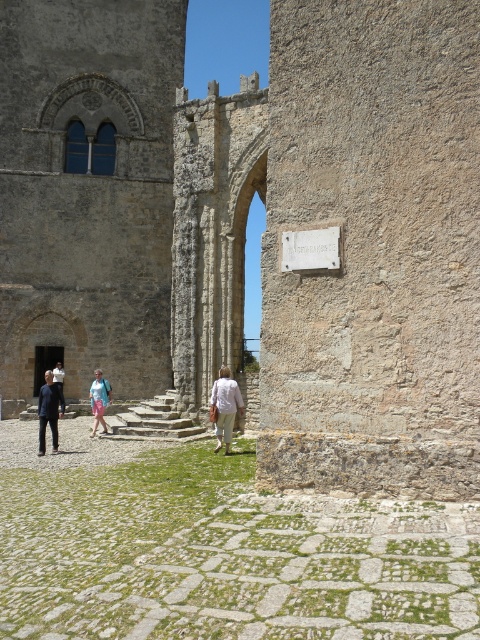
Between white stone plaque at center and dark blue shirt at lower left, which one is positioned higher?

white stone plaque at center is above.

Image resolution: width=480 pixels, height=640 pixels. Describe the element at coordinates (311, 250) in the screenshot. I see `white stone plaque at center` at that location.

Where is `white stone plaque at center`? The height and width of the screenshot is (640, 480). white stone plaque at center is located at coordinates (311, 250).

Is dark blue shirt at lower left above light blue denim shorts at center?

Correct, dark blue shirt at lower left is located above light blue denim shorts at center.

Is dark blue shirt at lower left shorter than light blue denim shorts at center?

Incorrect, dark blue shirt at lower left's height does not fall short of light blue denim shorts at center's.

Where is `dark blue shirt at lower left`? dark blue shirt at lower left is located at coordinates (49, 410).

Based on the photo, does dark blue shirt at lower left appear under dark gray fabric pants at lower left?

Yes, dark blue shirt at lower left is below dark gray fabric pants at lower left.

Looking at this image, who is more distant from viewer, (58, 416) or (60, 387)?

The point (60, 387) is behind.

Where is `dark blue shirt at lower left`? dark blue shirt at lower left is located at coordinates (49, 410).